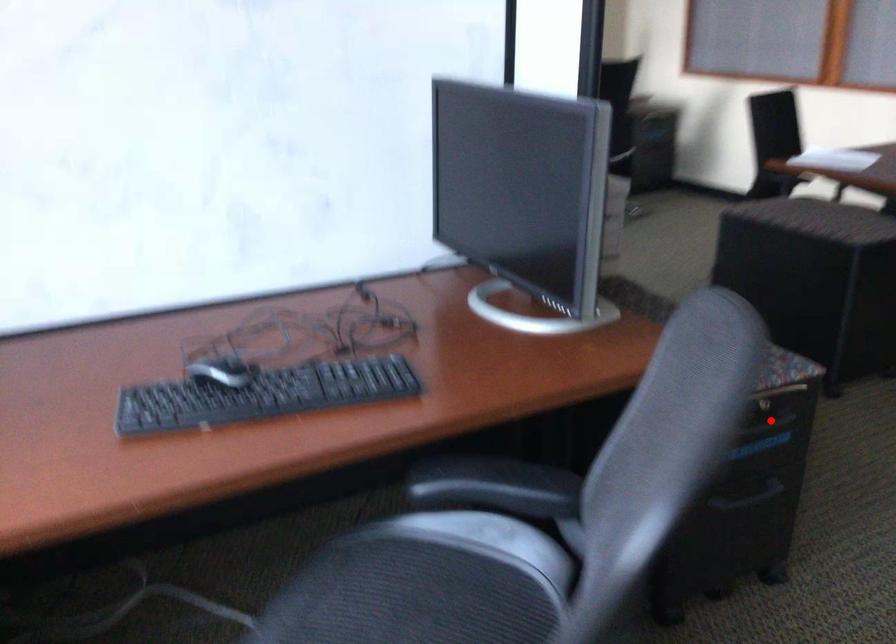
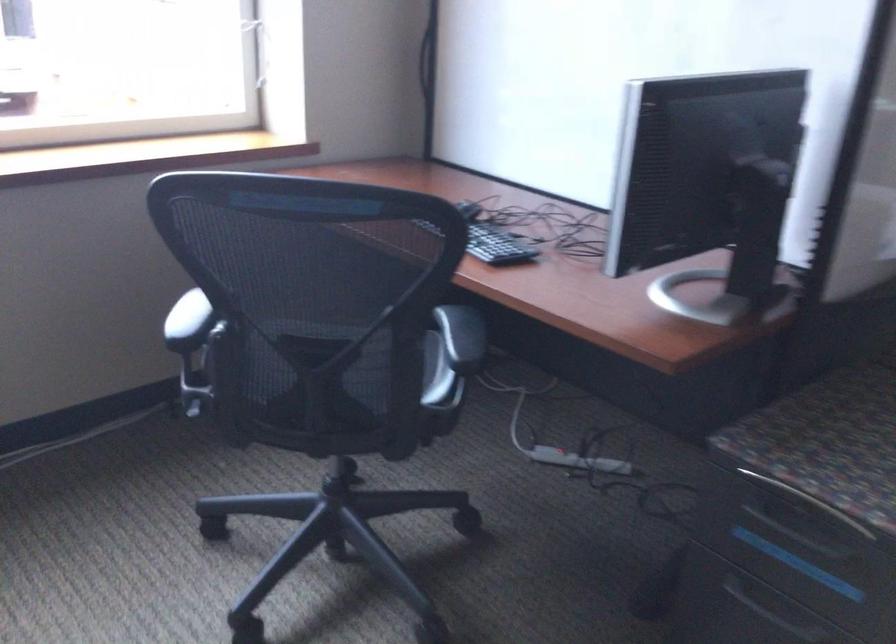
Question: A red point is marked in image1. In image2, is the corresponding 3D point closer to the camera or farther? Reply with the corresponding letter.

Choices:
 (A) The corresponding 3D point is closer.
 (B) The corresponding 3D point is farther.

Answer: (A)